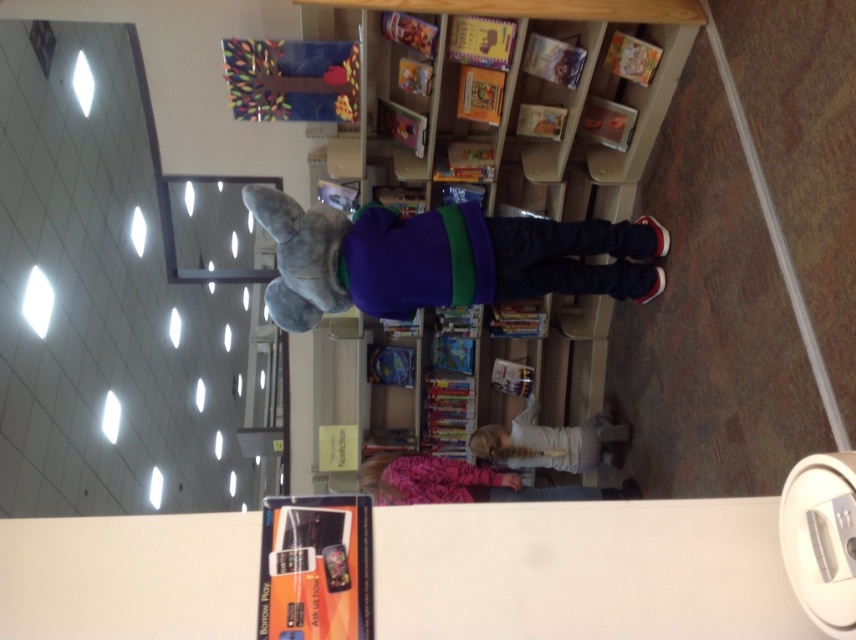
Looking at this image, is wooden bookcase at center below pink fleece jacket at lower center?

A: Actually, wooden bookcase at center is above pink fleece jacket at lower center.

Is wooden bookcase at center to the right of pink fleece jacket at lower center from the viewer's perspective?

Indeed, wooden bookcase at center is positioned on the right side of pink fleece jacket at lower center.

Between point (565, 125) and point (412, 456), which one is positioned behind?

The point (412, 456) is more distant.

What are the coordinates of `wooden bookcase at center` in the screenshot? It's located at (522, 97).

Between plush gray elephant at center and white matte shirt at center, which one is positioned lower?

Positioned lower is white matte shirt at center.

Is point (266, 307) closer to camera compared to point (614, 433)?

Yes, point (266, 307) is in front of point (614, 433).

Locate an element on the screen. plush gray elephant at center is located at coordinates (441, 259).

Can you confirm if plush gray elephant at center is positioned to the left of pink fleece jacket at lower center?

Correct, you'll find plush gray elephant at center to the left of pink fleece jacket at lower center.

This screenshot has height=640, width=856. Identify the location of plush gray elephant at center. (441, 259).

Where is `plush gray elephant at center`? plush gray elephant at center is located at coordinates (441, 259).